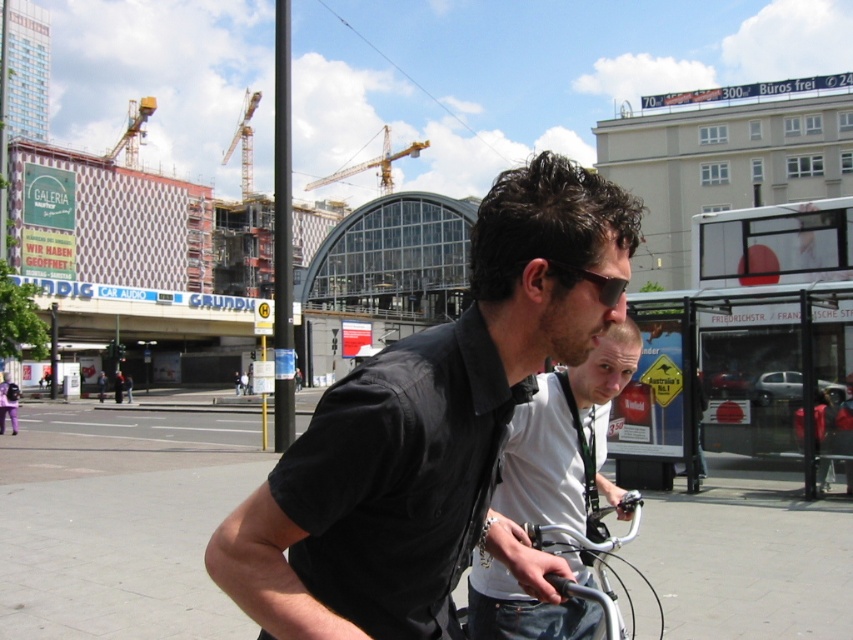
Question: Estimate the real-world distances between objects in this image. Which object is farther from the yellow metallic crane at upper left?

Choices:
 (A) gray concrete pavement at center
 (B) matte black shirt at center
 (C) silver metallic bicycle handlebars at center
 (D) black matte shirt at center

Answer: (C)

Question: Is black matte shirt at center thinner than black matte sunglasses at center?

Choices:
 (A) yes
 (B) no

Answer: (B)

Question: Does black matte shirt at center appear under gray concrete pavement at center?

Choices:
 (A) no
 (B) yes

Answer: (A)

Question: Which point is closer to the camera?

Choices:
 (A) (570, 412)
 (B) (126, 140)
 (C) (323, 605)

Answer: (C)

Question: Can you confirm if yellow metallic crane at upper center is thinner than black matte sunglasses at center?

Choices:
 (A) yes
 (B) no

Answer: (B)

Question: Which point is closer to the camera?

Choices:
 (A) (6, 540)
 (B) (126, 132)

Answer: (A)